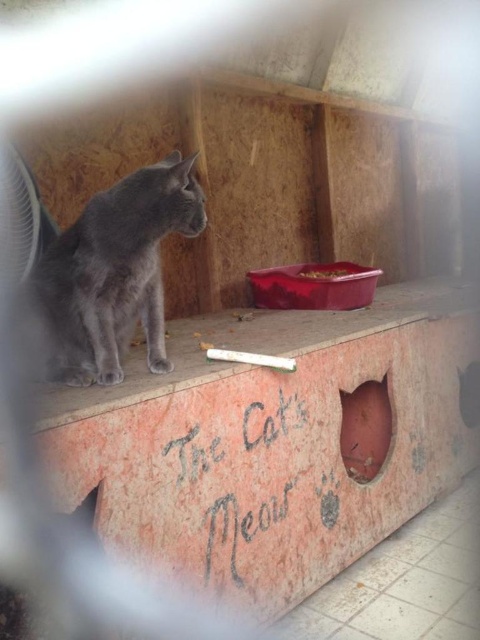
Can you confirm if gray chalk writing at center is positioned above white matte cigarette at center?

No, gray chalk writing at center is not above white matte cigarette at center.

Between gray chalk writing at center and white matte cigarette at center, which one appears on the left side from the viewer's perspective?

gray chalk writing at center

Find the location of a particular element. This screenshot has width=480, height=640. gray chalk writing at center is located at coordinates (235, 472).

Between rustic concrete ledge at center and white matte cigarette at center, which one appears on the right side from the viewer's perspective?

Positioned to the right is rustic concrete ledge at center.

Is point (227, 454) in front of point (263, 365)?

Yes, it is in front of point (263, 365).

You are a GUI agent. You are given a task and a screenshot of the screen. Output one action in this format:
    pyautogui.click(x=<x>, y=<y>)
    Task: Click on the rustic concrete ledge at center
    
    Given the screenshot: What is the action you would take?
    277,440

Is rustic concrete ledge at center wider than gray chalk writing at center?

Indeed, rustic concrete ledge at center has a greater width compared to gray chalk writing at center.

Between rustic concrete ledge at center and gray chalk writing at center, which one appears on the right side from the viewer's perspective?

rustic concrete ledge at center is more to the right.

What do you see at coordinates (277, 440) in the screenshot? I see `rustic concrete ledge at center` at bounding box center [277, 440].

Identify the location of rustic concrete ledge at center. The width and height of the screenshot is (480, 640). (277, 440).